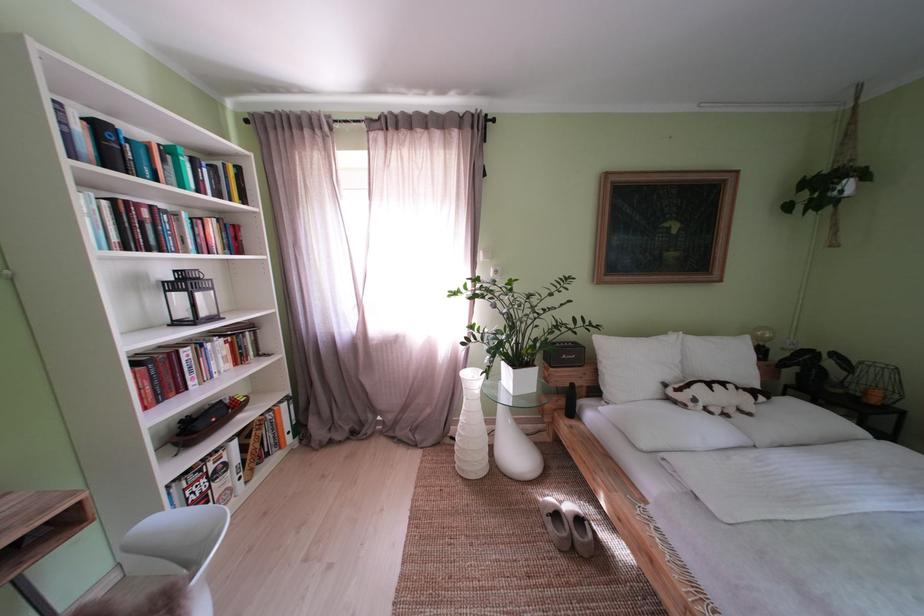
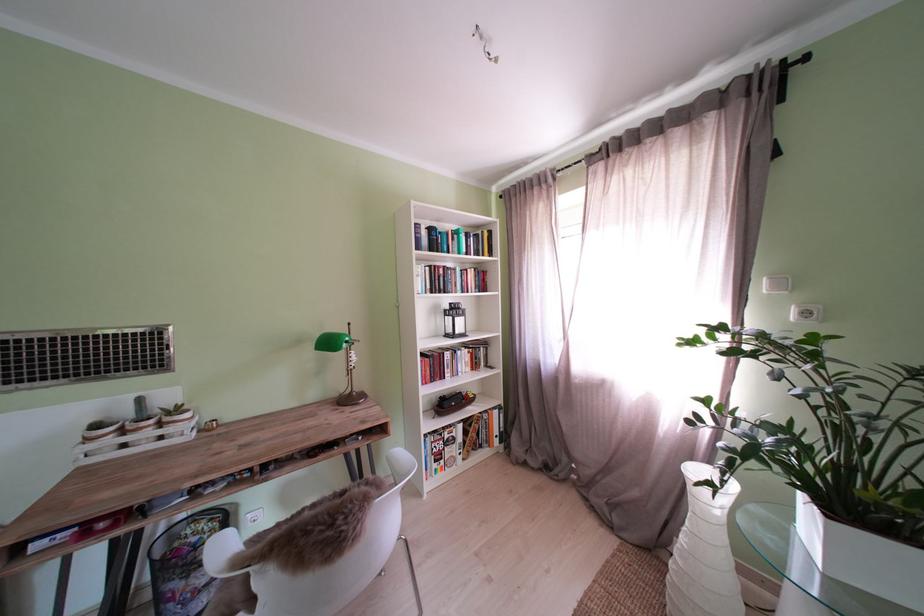
In the second image, find the point that corresponds to [215,464] in the first image.

(456, 434)